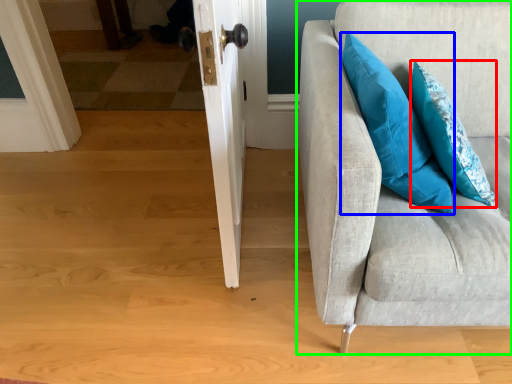
Question: Which object is the closest to the pillow (highlighted by a red box)? Choose among these: pillow (highlighted by a blue box) or studio couch (highlighted by a green box).

Choices:
 (A) pillow
 (B) studio couch

Answer: (A)